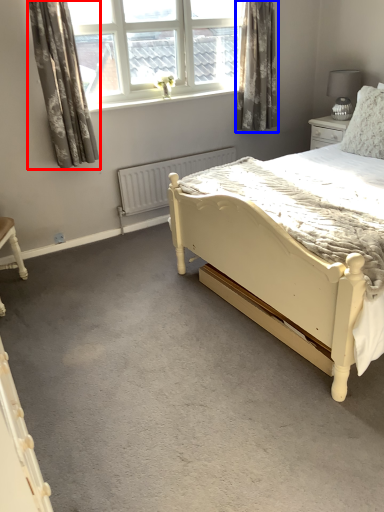
Question: Which of the following is the closest to the observer, curtain (highlighted by a red box) or curtain (highlighted by a blue box)?

Choices:
 (A) curtain
 (B) curtain

Answer: (A)